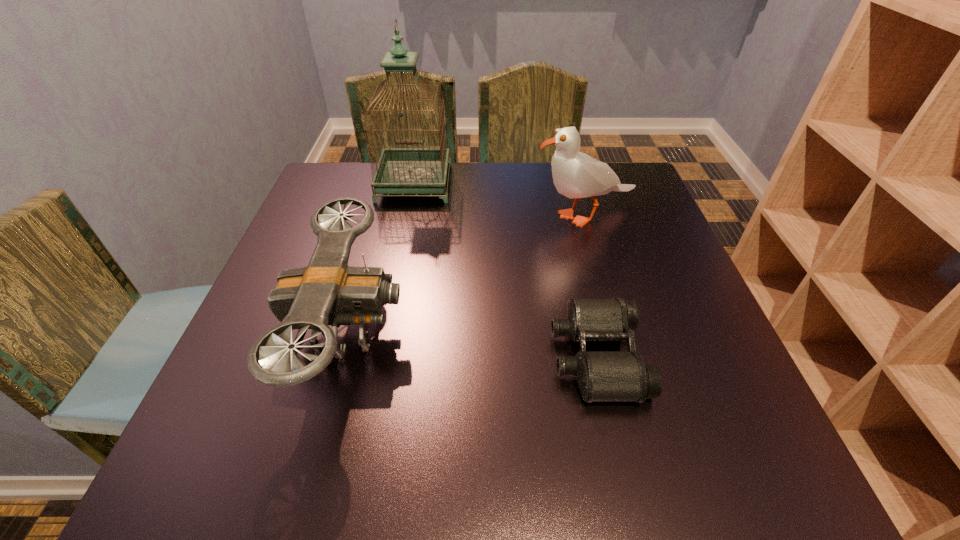
Where is `vacant area that lies between the gull and the drone`? The width and height of the screenshot is (960, 540). vacant area that lies between the gull and the drone is located at coordinates (467, 273).

Image resolution: width=960 pixels, height=540 pixels. Identify the location of vacant space in between the birdcage and the binoculars. (505, 270).

I want to click on vacant area that lies between the shortest object and the third shortest object, so [x=590, y=286].

The image size is (960, 540). Find the location of `vacant space in between the gull and the drone`. vacant space in between the gull and the drone is located at coordinates (467, 273).

This screenshot has height=540, width=960. In order to click on free space between the binoculars and the third shortest object in this screenshot , I will do `click(590, 286)`.

You are a GUI agent. You are given a task and a screenshot of the screen. Output one action in this format:
    pyautogui.click(x=<x>, y=<y>)
    Task: Click on the free spot between the drone and the birdcage
    
    Given the screenshot: What is the action you would take?
    pyautogui.click(x=381, y=256)

Identify which object is the third nearest to the second tallest object. Please provide its 2D coordinates. Your answer should be formatted as a tuple, i.e. [(x, y)], where the tuple contains the x and y coordinates of a point satisfying the conditions above.

[(328, 292)]

The height and width of the screenshot is (540, 960). In order to click on object that stands as the closest to the gull in this screenshot , I will do `click(401, 170)`.